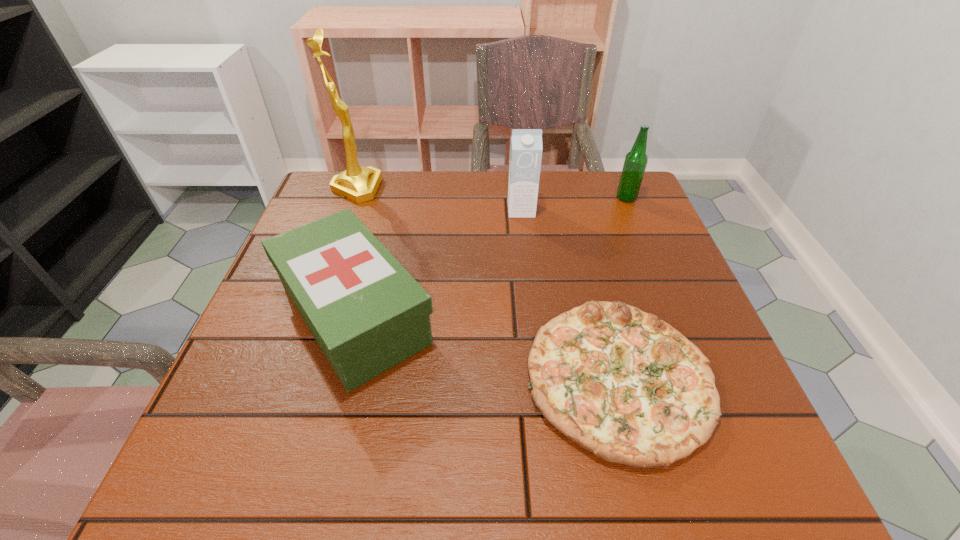
The height and width of the screenshot is (540, 960). What are the coordinates of `object identified as the second closest to the first-aid kit` in the screenshot? It's located at (359, 184).

Find the location of a particular element. free space that satisfies the following two spatial constraints: 1. on the front-facing side of the first-aid kit; 2. on the right side of the award is located at coordinates (310, 315).

Locate an element on the screen. blank space that satisfies the following two spatial constraints: 1. on the front-facing side of the award; 2. on the right side of the pizza is located at coordinates tap(287, 377).

The image size is (960, 540). I want to click on free space that satisfies the following two spatial constraints: 1. on the back side of the pizza; 2. on the front-facing side of the tallest object, so click(x=569, y=188).

What are the coordinates of `free location that satisfies the following two spatial constraints: 1. on the front-facing side of the tallest object; 2. on the left side of the fourth tallest object` in the screenshot? It's located at (310, 315).

You are a GUI agent. You are given a task and a screenshot of the screen. Output one action in this format:
    pyautogui.click(x=<x>, y=<y>)
    Task: Click on the vacant region that satisfies the following two spatial constraints: 1. on the front-facing side of the pizza; 2. on the left side of the tallest object
    
    Given the screenshot: What is the action you would take?
    pyautogui.click(x=287, y=377)

You are a GUI agent. You are given a task and a screenshot of the screen. Output one action in this format:
    pyautogui.click(x=<x>, y=<y>)
    Task: Click on the free region that satisfies the following two spatial constraints: 1. on the label of the beer bottle; 2. on the front label of the carton
    The image size is (960, 540).
    Given the screenshot: What is the action you would take?
    pyautogui.click(x=632, y=210)

Find the location of a particular element. vacant position in the image that satisfies the following two spatial constraints: 1. on the front label of the shortest object; 2. on the left side of the carton is located at coordinates (540, 377).

Locate an element on the screen. free space that satisfies the following two spatial constraints: 1. on the back side of the first-aid kit; 2. on the front-facing side of the tallest object is located at coordinates (389, 188).